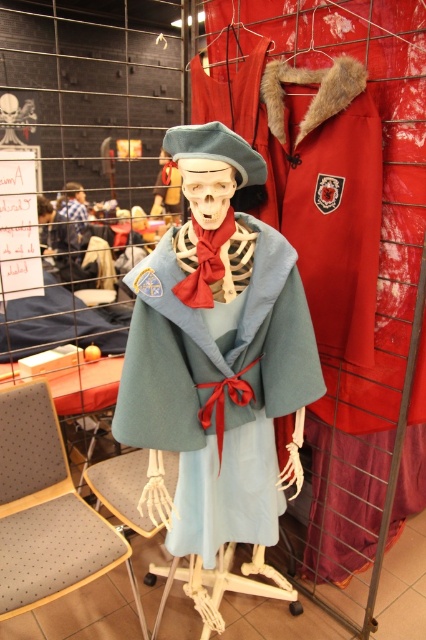
Who is positioned more to the left, light blue woolen cape at center or blue plaid shirt at center?

blue plaid shirt at center is more to the left.

Identify the location of light blue woolen cape at center. This screenshot has height=640, width=426. (218, 388).

The image size is (426, 640). What are the coordinates of `light blue woolen cape at center` in the screenshot? It's located at (218, 388).

Between light blue woolen cape at center and gray fabric chair at lower left, which one appears on the right side from the viewer's perspective?

light blue woolen cape at center

Is point (256, 342) behind point (48, 444)?

No.

Where is `light blue woolen cape at center`? The height and width of the screenshot is (640, 426). light blue woolen cape at center is located at coordinates (218, 388).

Measure the distance from gray fabric chair at lower left to blue plaid shirt at center.

gray fabric chair at lower left and blue plaid shirt at center are 3.50 meters apart.

Is the position of gray fabric chair at lower left less distant than that of blue plaid shirt at center?

Yes.

Who is more forward, (x=46, y=435) or (x=68, y=204)?

Point (x=46, y=435) is more forward.

This screenshot has width=426, height=640. I want to click on gray fabric chair at lower left, so click(46, 512).